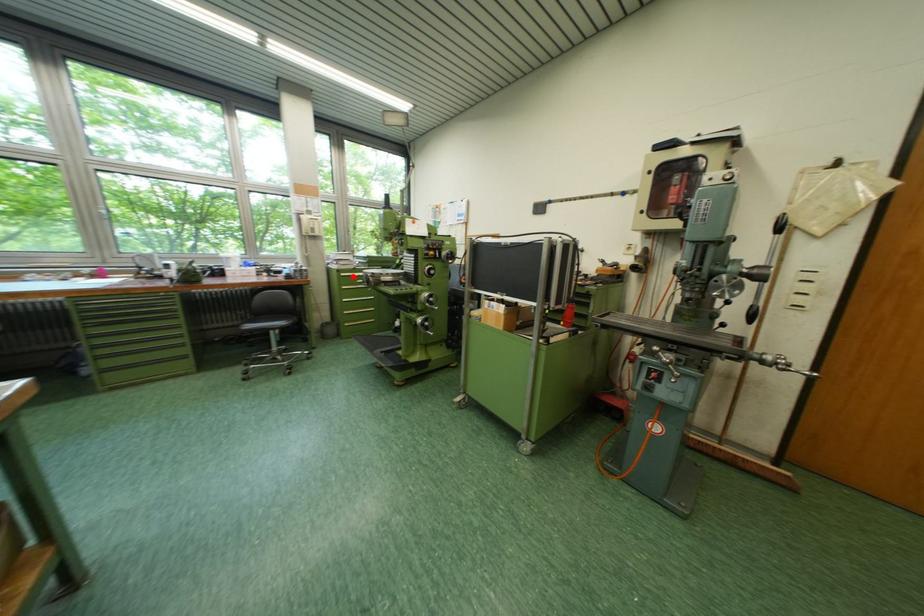
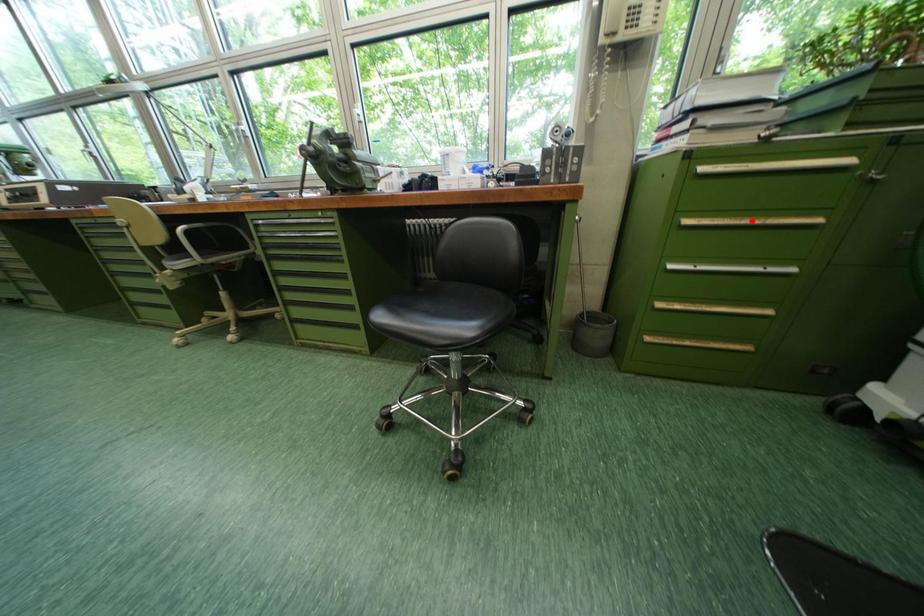
I am providing you with two images of the same scene from different viewpoints. A red point is marked on the first image and another point is marked on the second image. Is the marked point in image1 the same physical position as the marked point in image2?

No